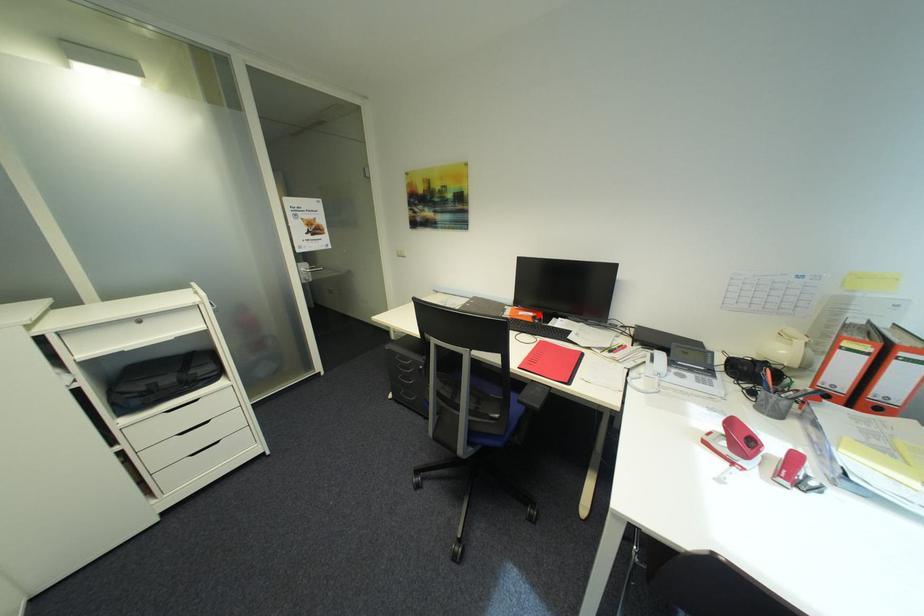
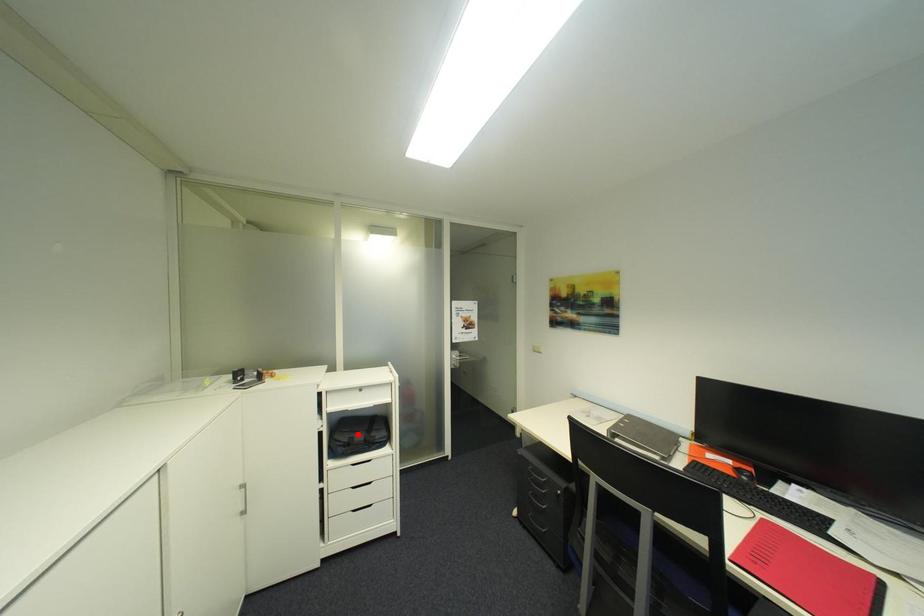
I am providing you with two images of the same scene from different viewpoints. A red point is marked on the first image and another point is marked on the second image. Does the point marked in image1 correspond to the same location as the one in image2?

No